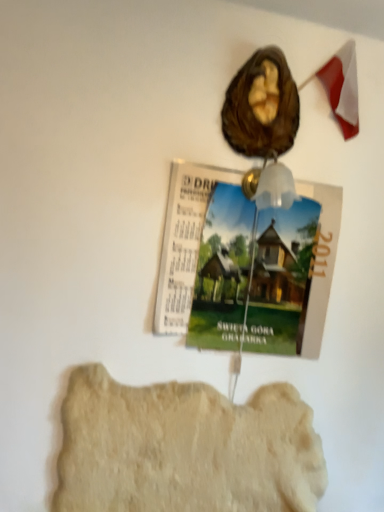
Question: From a real-world perspective, is green paper magazine at upper center positioned over light beige stone at lower center based on gravity?

Choices:
 (A) yes
 (B) no

Answer: (A)

Question: Is green paper magazine at upper center oriented towards light beige stone at lower center?

Choices:
 (A) yes
 (B) no

Answer: (B)

Question: Does green paper magazine at upper center lie in front of light beige stone at lower center?

Choices:
 (A) no
 (B) yes

Answer: (A)

Question: Is the depth of green paper magazine at upper center greater than that of light beige stone at lower center?

Choices:
 (A) yes
 (B) no

Answer: (A)

Question: Would you say light beige stone at lower center is part of green paper magazine at upper center's contents?

Choices:
 (A) no
 (B) yes

Answer: (A)

Question: Is light beige stone at lower center bigger or smaller than green paper magazine at upper center?

Choices:
 (A) small
 (B) big

Answer: (B)

Question: Considering the relative positions of light beige stone at lower center and green paper magazine at upper center in the image provided, is light beige stone at lower center to the left or to the right of green paper magazine at upper center?

Choices:
 (A) left
 (B) right

Answer: (A)

Question: From a real-world perspective, is light beige stone at lower center above or below green paper magazine at upper center?

Choices:
 (A) above
 (B) below

Answer: (B)

Question: From the image's perspective, is light beige stone at lower center positioned above or below green paper magazine at upper center?

Choices:
 (A) below
 (B) above

Answer: (A)

Question: Considering their positions, is green paper magazine at upper center located in front of or behind light beige stone at lower center?

Choices:
 (A) behind
 (B) front

Answer: (A)

Question: From the image's perspective, is green paper magazine at upper center located above or below light beige stone at lower center?

Choices:
 (A) above
 (B) below

Answer: (A)

Question: Is green paper magazine at upper center taller or shorter than light beige stone at lower center?

Choices:
 (A) short
 (B) tall

Answer: (B)

Question: Is green paper magazine at upper center wider or thinner than light beige stone at lower center?

Choices:
 (A) wide
 (B) thin

Answer: (B)

Question: From the image's perspective, is green paper magazine at upper center positioned above or below brown matte walnut at upper center?

Choices:
 (A) below
 (B) above

Answer: (A)

Question: From a real-world perspective, relative to brown matte walnut at upper center, is green paper magazine at upper center vertically above or below?

Choices:
 (A) above
 (B) below

Answer: (B)